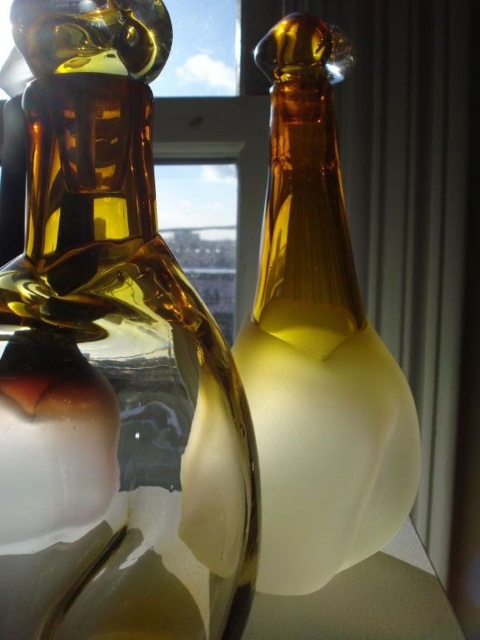
You are a delivery person who needs to place a new bottle exactly at the point marked by the coordinates point (x=317, y=342). The scene already has an amber glass bottle at center. Can you place the new bottle at the specified point without overlapping with the existing amber glass bottle at center?

The point (x=317, y=342) indicates the location of the amber glass bottle at center, so placing the new bottle there would overlap with the existing one. Choose a different spot to avoid overlap.

You are arranging flowers in the amber glass vase at left and need to place it on a shelf next to the amber glass bottle at center. Which object should you place first to ensure proper positioning?

You should place the amber glass vase at left first because it is closer to the viewer than the amber glass bottle at center, so it needs to be positioned in front.